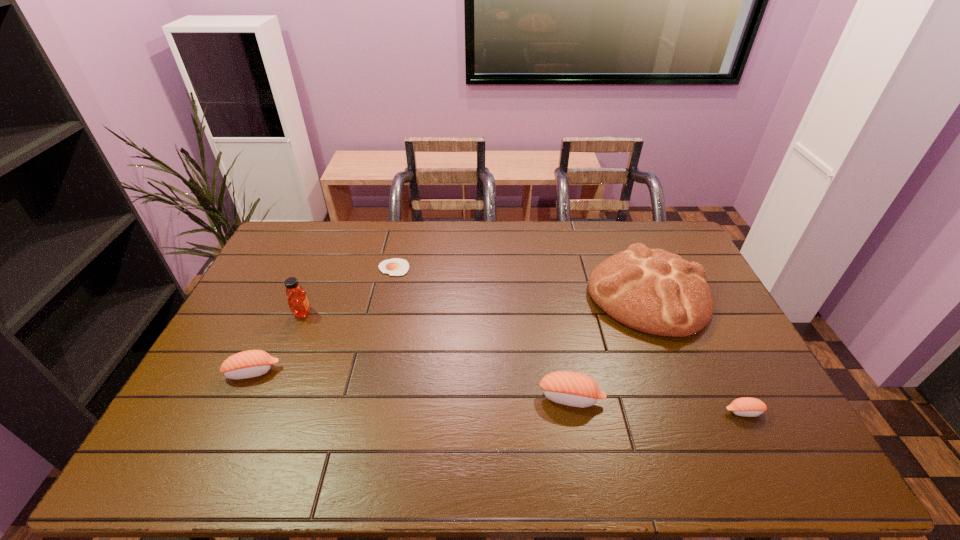
In order to click on the third closest sushi to the honey in this screenshot , I will do `click(748, 407)`.

Identify which sushi is the second closest to the third object from right to left. Please provide its 2D coordinates. Your answer should be formatted as a tuple, i.e. [(x, y)], where the tuple contains the x and y coordinates of a point satisfying the conditions above.

[(252, 363)]

I want to click on free location that satisfies the following two spatial constraints: 1. on the front label of the honey; 2. on the front side of the farthest sushi, so click(277, 372).

In order to click on free space that satisfies the following two spatial constraints: 1. on the back side of the second shortest object; 2. on the front label of the honey in this screenshot , I will do `click(693, 313)`.

Identify the location of vacant space that satisfies the following two spatial constraints: 1. on the front label of the honey; 2. on the right side of the rightmost sushi. The image size is (960, 540). (261, 412).

Find the location of a particular element. The height and width of the screenshot is (540, 960). free space that satisfies the following two spatial constraints: 1. on the back side of the leftmost sushi; 2. on the left side of the bread is located at coordinates (290, 295).

Where is `free region that satisfies the following two spatial constraints: 1. on the front label of the fourth object from left to right; 2. on the right side of the honey`? The width and height of the screenshot is (960, 540). free region that satisfies the following two spatial constraints: 1. on the front label of the fourth object from left to right; 2. on the right side of the honey is located at coordinates (267, 398).

Find the location of a particular element. The height and width of the screenshot is (540, 960). free space that satisfies the following two spatial constraints: 1. on the back side of the third object from right to left; 2. on the right side of the bread is located at coordinates (553, 295).

The height and width of the screenshot is (540, 960). What are the coordinates of `free location that satisfies the following two spatial constraints: 1. on the front label of the fourth object from left to right; 2. on the left side of the honey` in the screenshot? It's located at (267, 398).

Image resolution: width=960 pixels, height=540 pixels. I want to click on free space in the image that satisfies the following two spatial constraints: 1. on the front label of the honey; 2. on the front side of the fourth tallest object, so click(x=277, y=372).